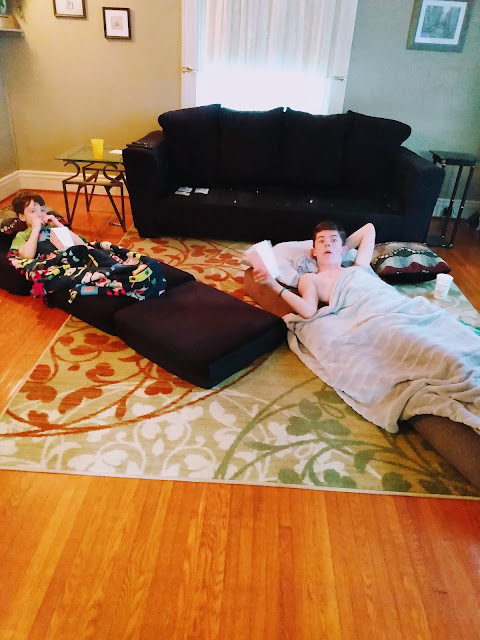
This screenshot has height=640, width=480. I want to click on pictures, so click(x=440, y=20), click(x=115, y=31), click(x=63, y=9).